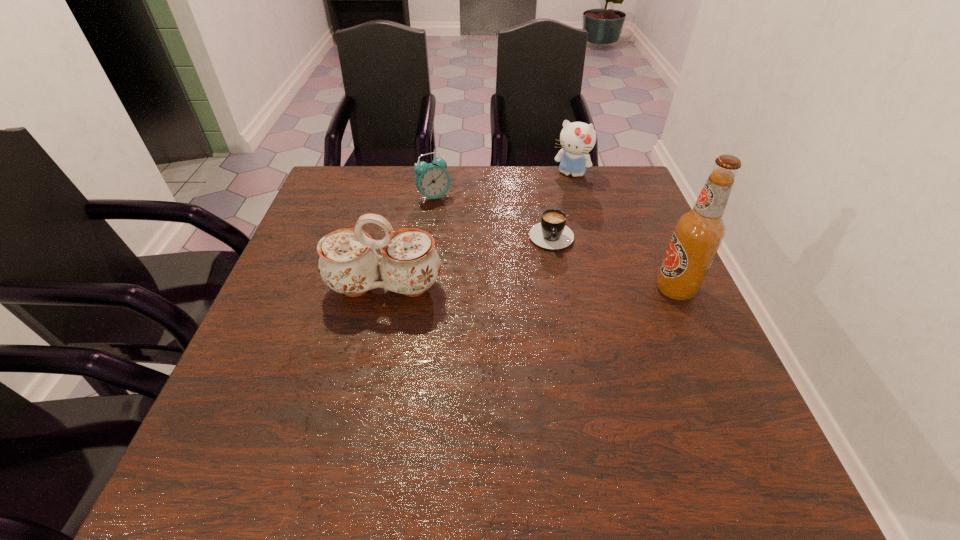
Choose which object is the fourth nearest neighbor to the chinaware. Please provide its 2D coordinates. Your answer should be formatted as a tuple, i.e. [(x, y)], where the tuple contains the x and y coordinates of a point satisfying the conditions above.

[(698, 233)]

Image resolution: width=960 pixels, height=540 pixels. I want to click on object that is the fourth closest one to the tallest object, so click(x=432, y=180).

The height and width of the screenshot is (540, 960). Find the location of `free point that satisfies the following two spatial constraints: 1. on the front side of the beer bottle; 2. on the front label of the third shortest object`. free point that satisfies the following two spatial constraints: 1. on the front side of the beer bottle; 2. on the front label of the third shortest object is located at coordinates (602, 289).

Locate an element on the screen. This screenshot has width=960, height=540. free point that satisfies the following two spatial constraints: 1. on the front side of the third shortest object; 2. on the front label of the rightmost object is located at coordinates (602, 289).

You are a GUI agent. You are given a task and a screenshot of the screen. Output one action in this format:
    pyautogui.click(x=<x>, y=<y>)
    Task: Click on the free space that satisfies the following two spatial constraints: 1. by the handle of the chinaware; 2. on the front label of the beer bottle
    This screenshot has height=540, width=960.
    Given the screenshot: What is the action you would take?
    pyautogui.click(x=384, y=289)

I want to click on vacant region that satisfies the following two spatial constraints: 1. on the back side of the alarm clock; 2. on the left side of the farthest object, so click(x=438, y=174).